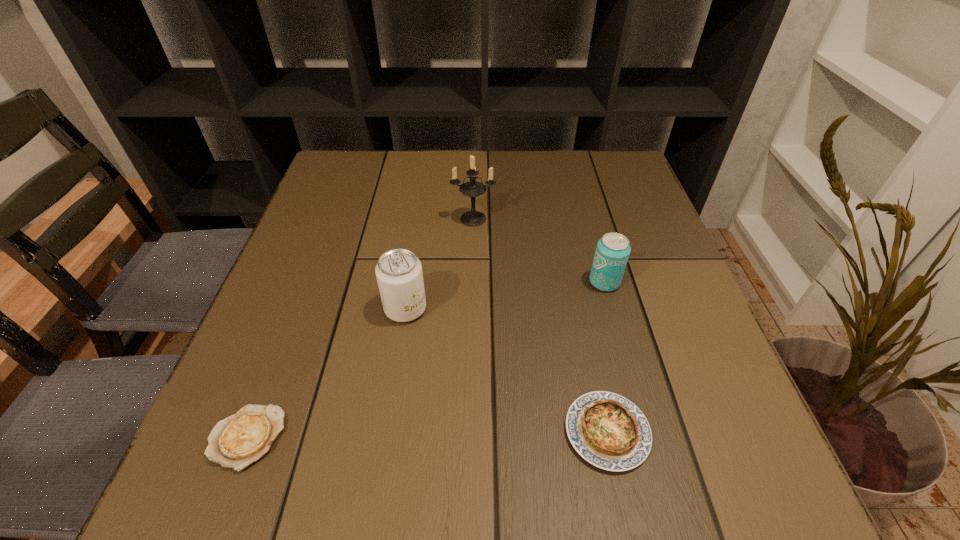
Find the location of a particular element. the third object from left to right is located at coordinates (473, 188).

Locate an element on the screen. candle holder is located at coordinates (473, 188).

Locate an element on the screen. This screenshot has height=540, width=960. the third nearest object is located at coordinates (399, 275).

At what (x,y) coordinates should I click in order to perform the action: click on soda can. Please return your answer as a coordinate pair (x, y). Image resolution: width=960 pixels, height=540 pixels. Looking at the image, I should click on (399, 275).

Identify the location of beer can. This screenshot has width=960, height=540. (612, 252).

I want to click on the right quiche, so click(609, 431).

In order to click on the fourth tallest object in this screenshot , I will do `click(609, 431)`.

The image size is (960, 540). I want to click on the leftmost object, so click(x=239, y=440).

Locate an element on the screen. the left quiche is located at coordinates (239, 440).

The height and width of the screenshot is (540, 960). In order to click on free space located on the left of the third object from right to left in this screenshot , I will do `click(392, 219)`.